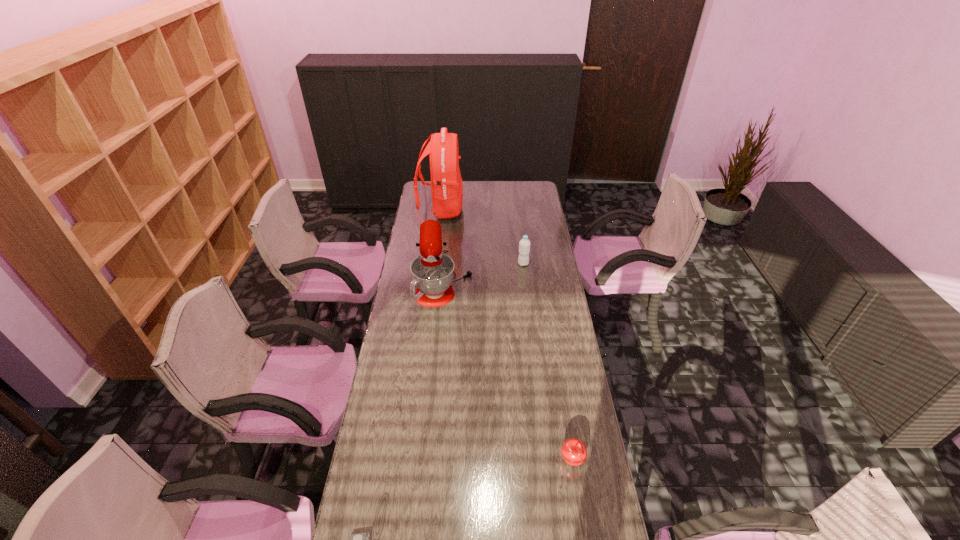
Locate an element on the screen. This screenshot has width=960, height=540. free space located on the front of the fourth farthest object is located at coordinates (578, 493).

Find the location of a particular element. The width and height of the screenshot is (960, 540). object that is at the far edge is located at coordinates (446, 184).

The image size is (960, 540). Identify the location of backpack situated at the left edge. pos(446,184).

You are a GUI agent. You are given a task and a screenshot of the screen. Output one action in this format:
    pyautogui.click(x=<x>, y=<y>)
    Task: Click on the mixer at the left edge
    This screenshot has width=960, height=540.
    Given the screenshot: What is the action you would take?
    pyautogui.click(x=432, y=271)

This screenshot has width=960, height=540. Find the location of `water bottle located in the right edge section of the desktop`. water bottle located in the right edge section of the desktop is located at coordinates (524, 246).

Identify the location of cherry present at the right edge. This screenshot has width=960, height=540. (574, 452).

The height and width of the screenshot is (540, 960). In order to click on object present at the far left corner in this screenshot , I will do `click(446, 184)`.

This screenshot has width=960, height=540. I want to click on free space at the far edge, so click(x=479, y=186).

This screenshot has height=540, width=960. In order to click on free space at the left edge in this screenshot , I will do `click(421, 379)`.

You are a GUI agent. You are given a task and a screenshot of the screen. Output one action in this format:
    pyautogui.click(x=<x>, y=<y>)
    Task: Click on the vacant area at the right edge of the desktop
    
    Given the screenshot: What is the action you would take?
    pyautogui.click(x=562, y=292)